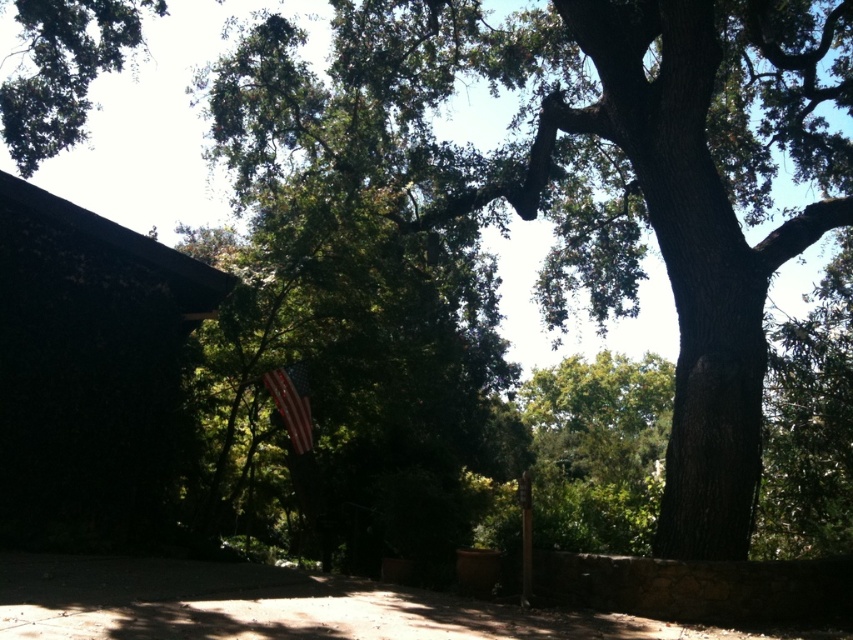
Question: Which point is farther to the camera?

Choices:
 (A) green leafy tree at upper left
 (B) american flag at center

Answer: (B)

Question: Which point appears closest to the camera in this image?

Choices:
 (A) click(132, 42)
 (B) click(622, 148)
 (C) click(288, 385)

Answer: (B)

Question: Is smooth bark oak tree at center further to the viewer compared to american flag at center?

Choices:
 (A) no
 (B) yes

Answer: (A)

Question: Which object is farther from the camera taking this photo?

Choices:
 (A) green leafy tree at upper left
 (B) smooth bark oak tree at center
 (C) american flag at center

Answer: (C)

Question: Considering the relative positions of green leafy tree at upper left and american flag at center in the image provided, where is green leafy tree at upper left located with respect to american flag at center?

Choices:
 (A) above
 (B) below

Answer: (A)

Question: Is smooth bark oak tree at center in front of american flag at center?

Choices:
 (A) no
 (B) yes

Answer: (B)